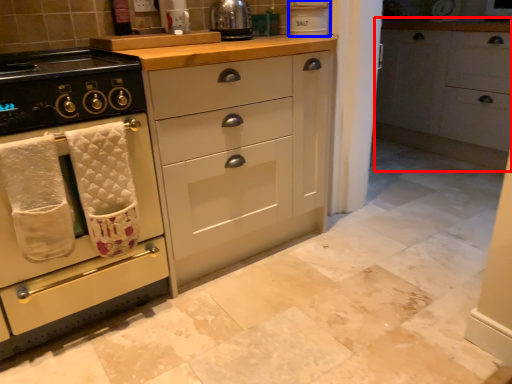
Question: Which of the following is the closest to the observer, cabinetry (highlighted by a red box) or appliance (highlighted by a blue box)?

Choices:
 (A) cabinetry
 (B) appliance

Answer: (B)